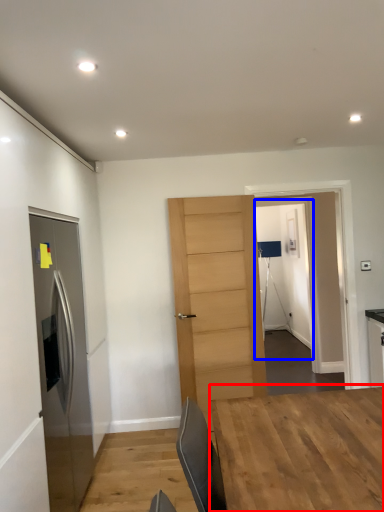
Question: Which object appears farthest to the camera in this image, table (highlighted by a red box) or glass door (highlighted by a blue box)?

Choices:
 (A) table
 (B) glass door

Answer: (B)